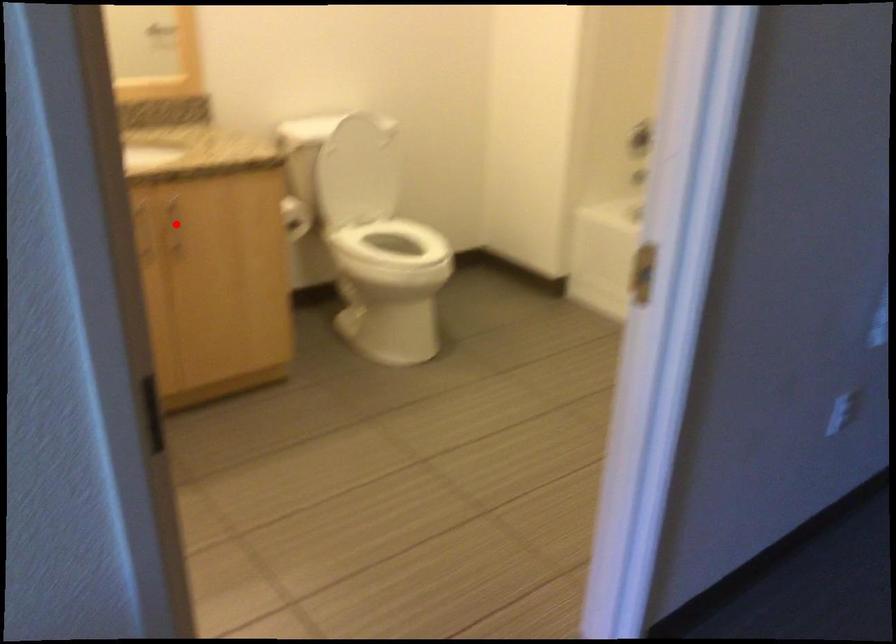
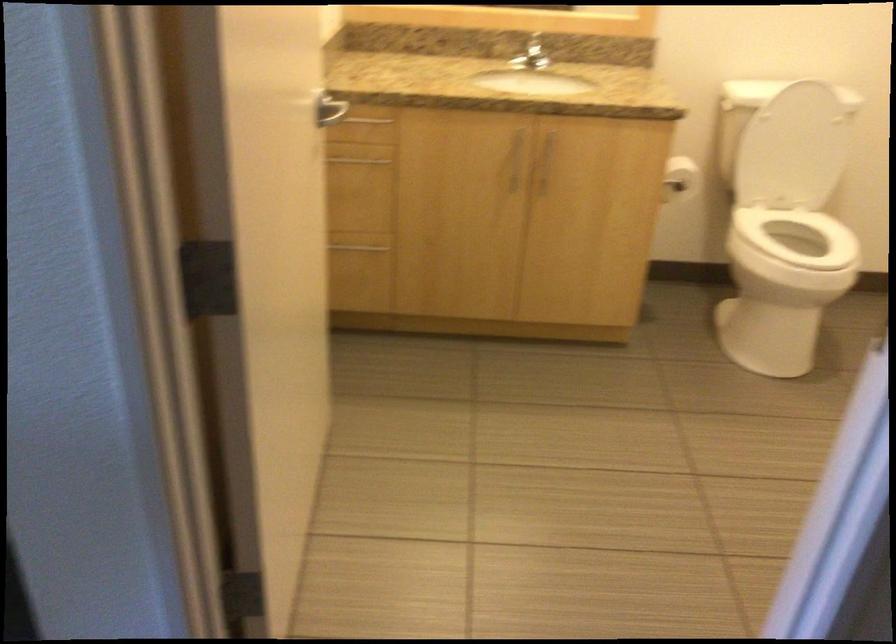
The point at the highlighted location is marked in the first image. Where is the corresponding point in the second image?

(545, 162)